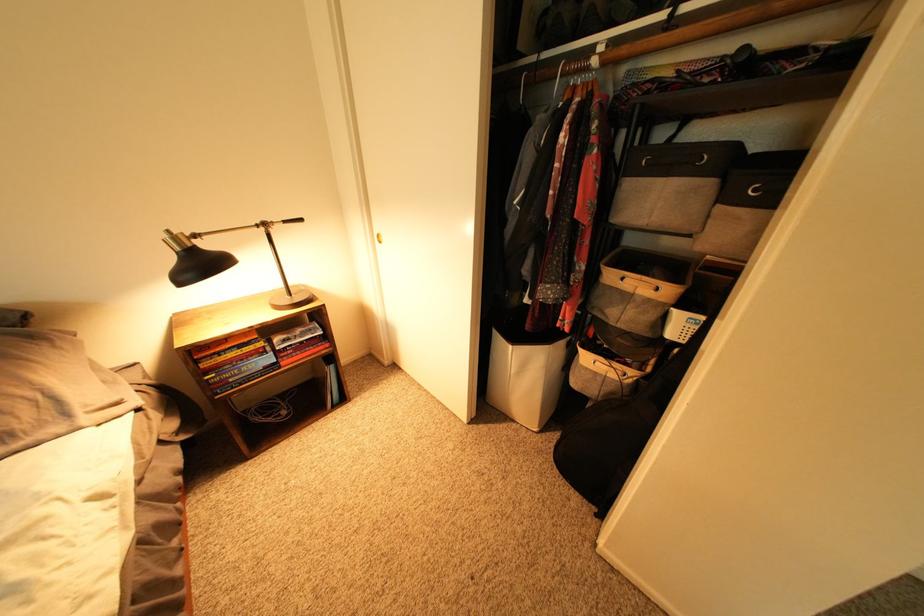
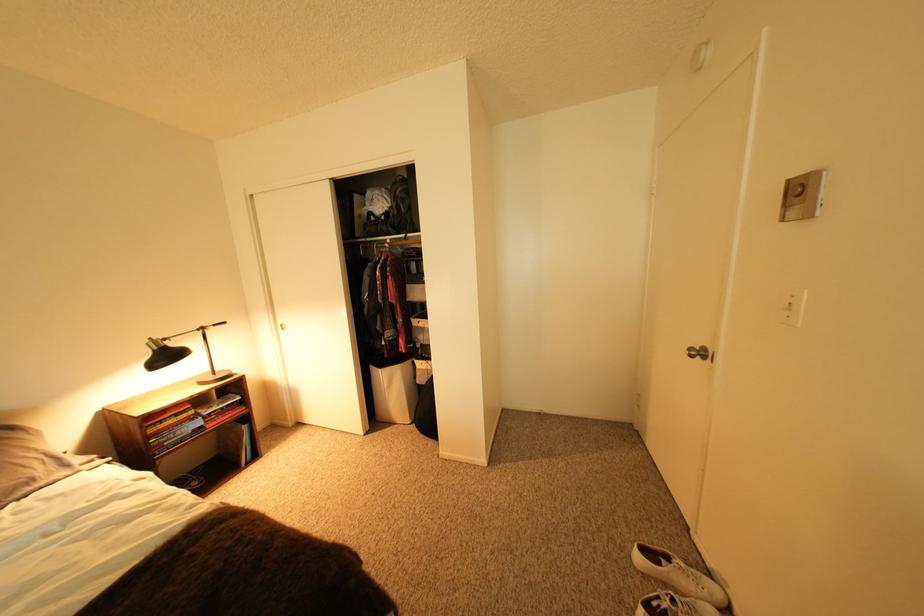
Locate, in the second image, the point that corresponds to (x=191, y=251) in the first image.

(168, 350)